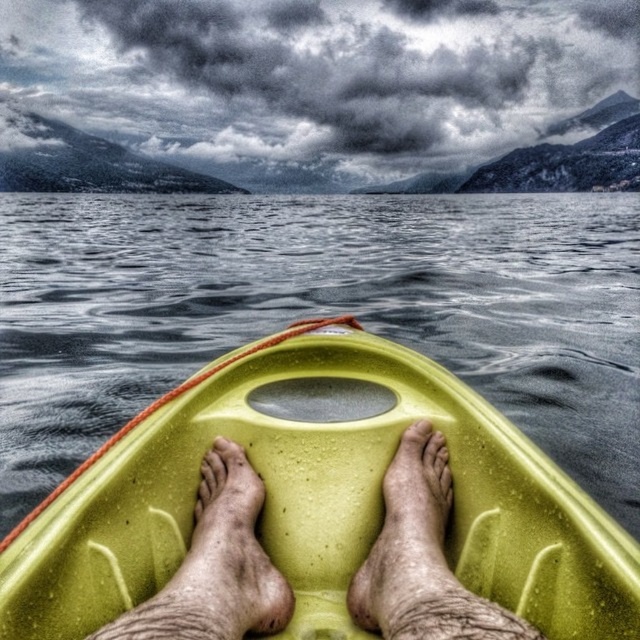
Based on the photo, is green matte kayak at center smaller than matte yellow kayak at center?

No, green matte kayak at center is not smaller than matte yellow kayak at center.

Is green matte kayak at center wider than matte yellow kayak at center?

Correct, the width of green matte kayak at center exceeds that of matte yellow kayak at center.

Where is `green matte kayak at center`? green matte kayak at center is located at coordinates (317, 497).

This screenshot has width=640, height=640. Find the location of `green matte kayak at center`. green matte kayak at center is located at coordinates (317, 497).